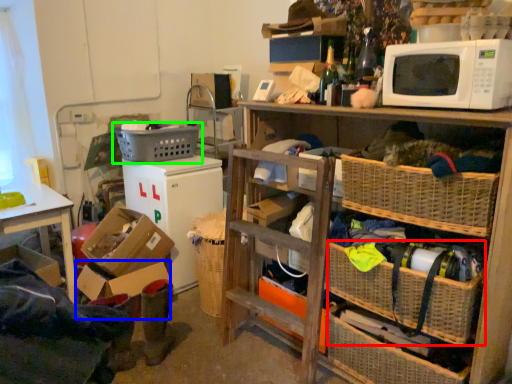
Question: Estimate the real-world distances between objects in this image. Which object is closer to basket (highlighted by a red box), box (highlighted by a blue box) or picnic basket (highlighted by a green box)?

Choices:
 (A) box
 (B) picnic basket

Answer: (A)